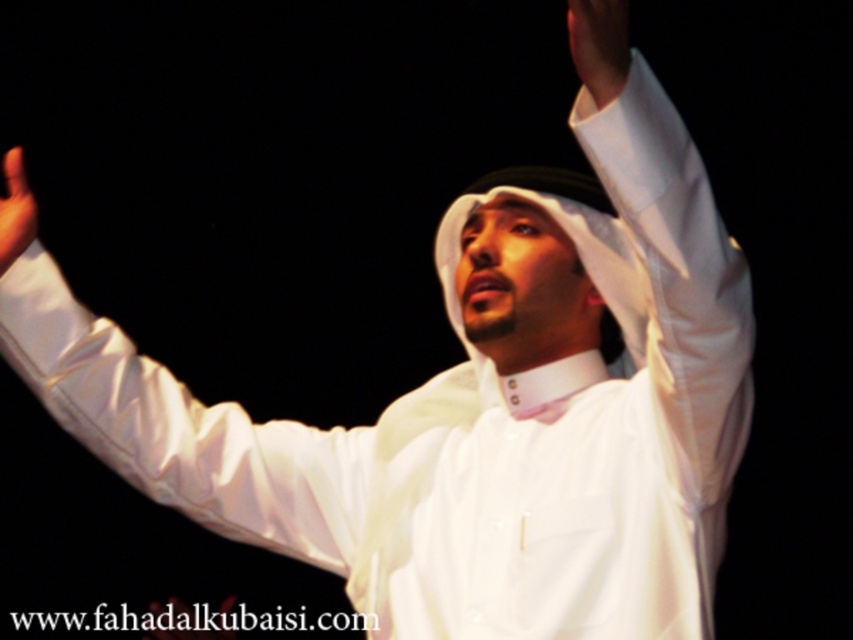
Looking at this image, you are standing at the camera position and want to take a photo of the person in the white thobe and white keffiyeh. The point you need to focus on is at point (x=585, y=64). If your camera has a focusing range of up to 5 feet, will you be able to focus on that point?

The point at (x=585, y=64) is 5.12 feet away from the camera. Since the camera can only focus up to 5 feet, it will not be able to focus on that point.